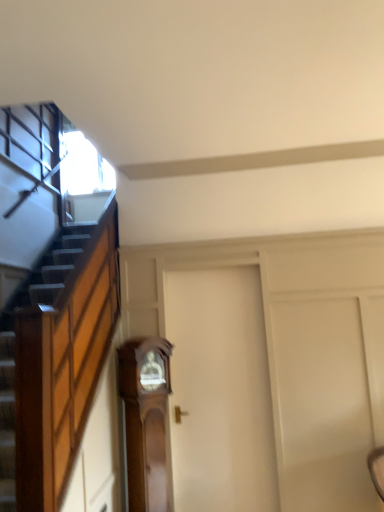
The height and width of the screenshot is (512, 384). Describe the element at coordinates (145, 419) in the screenshot. I see `wooden grandfather clock at center` at that location.

At what (x,y) coordinates should I click in order to perform the action: click on wooden grandfather clock at center. Please return your answer as a coordinate pair (x, y). The height and width of the screenshot is (512, 384). Looking at the image, I should click on (145, 419).

The width and height of the screenshot is (384, 512). What do you see at coordinates (220, 391) in the screenshot?
I see `white matte door at center` at bounding box center [220, 391].

This screenshot has width=384, height=512. What are the coordinates of `white matte door at center` in the screenshot? It's located at (220, 391).

You are a GUI agent. You are given a task and a screenshot of the screen. Output one action in this format:
    pyautogui.click(x=<x>, y=<y>)
    Task: Click on the wooden grandfather clock at center
    The width and height of the screenshot is (384, 512).
    Given the screenshot: What is the action you would take?
    pyautogui.click(x=145, y=419)

Would you say wooden grandfather clock at center is to the left or to the right of white matte door at center in the picture?

wooden grandfather clock at center is to the left of white matte door at center.

Considering the relative positions of wooden grandfather clock at center and white matte door at center in the image provided, is wooden grandfather clock at center behind white matte door at center?

No.

Considering the points (146, 473) and (225, 470), which point is in front, point (146, 473) or point (225, 470)?

The point (146, 473) is closer to the camera.

From the image's perspective, between wooden grandfather clock at center and white matte door at center, who is located below?

From the image's view, wooden grandfather clock at center is below.

From a real-world perspective, is wooden grandfather clock at center located higher than white matte door at center?

No, from a real-world perspective, wooden grandfather clock at center is not above white matte door at center.

Considering the sizes of wooden grandfather clock at center and white matte door at center in the image, is wooden grandfather clock at center wider or thinner than white matte door at center?

In the image, wooden grandfather clock at center appears to be wider than white matte door at center.

Can you confirm if wooden grandfather clock at center is taller than white matte door at center?

In fact, wooden grandfather clock at center may be shorter than white matte door at center.

Can you confirm if wooden grandfather clock at center is bigger than white matte door at center?

No, wooden grandfather clock at center is not bigger than white matte door at center.

Is wooden grandfather clock at center inside or outside of white matte door at center?

wooden grandfather clock at center is not enclosed by white matte door at center.

Is there a large distance between wooden grandfather clock at center and white matte door at center?

No.

Could you tell me if wooden grandfather clock at center is turned towards white matte door at center?

No, wooden grandfather clock at center is not aimed at white matte door at center.

Measure the distance from wooden grandfather clock at center to white matte door at center.

15.53 inches.

This screenshot has height=512, width=384. In order to click on door above the wooden grandfather clock at center (from the image's perspective) in this screenshot , I will do `click(220, 391)`.

Between white matte door at center and wooden grandfather clock at center, which one appears on the left side from the viewer's perspective?

wooden grandfather clock at center is more to the left.

Between white matte door at center and wooden grandfather clock at center, which one is positioned behind?

white matte door at center is more distant.

Which is behind, point (244, 401) or point (120, 353)?

The point (244, 401) is farther from the camera.

From the image's perspective, is white matte door at center over wooden grandfather clock at center?

Correct, white matte door at center appears higher than wooden grandfather clock at center in the image.

From a real-world perspective, does white matte door at center stand above wooden grandfather clock at center?

Yes, from a real-world perspective, white matte door at center is on top of wooden grandfather clock at center.

Looking at their sizes, would you say white matte door at center is wider or thinner than wooden grandfather clock at center?

In the image, white matte door at center appears to be more narrow than wooden grandfather clock at center.

Can you confirm if white matte door at center is taller than wooden grandfather clock at center?

Correct, white matte door at center is much taller as wooden grandfather clock at center.

Based on the photo, considering the relative sizes of white matte door at center and wooden grandfather clock at center in the image provided, is white matte door at center bigger than wooden grandfather clock at center?

Yes.

Is wooden grandfather clock at center a part of white matte door at center?

No, wooden grandfather clock at center is not surrounded by white matte door at center.

Are white matte door at center and wooden grandfather clock at center making contact?

No, white matte door at center is not making contact with wooden grandfather clock at center.

Is white matte door at center oriented away from wooden grandfather clock at center?

white matte door at center is not turned away from wooden grandfather clock at center.

Locate an element on the screen. door lying above the wooden grandfather clock at center (from the image's perspective) is located at coordinates (220, 391).

Locate an element on the screen. This screenshot has height=512, width=384. door positioned vertically above the wooden grandfather clock at center (from a real-world perspective) is located at coordinates (220, 391).

I want to click on furniture on the left of white matte door at center, so click(x=145, y=419).